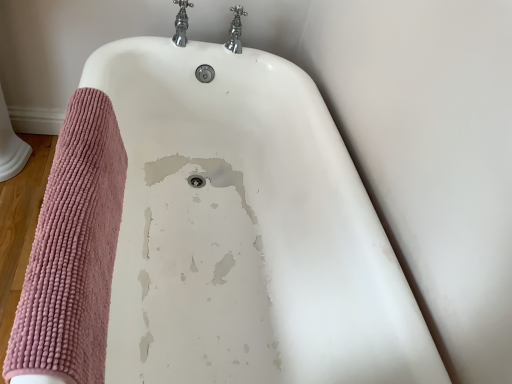
Measure the distance between point (180,10) and camera.

Point (180,10) is 1.57 meters away from camera.

Describe the element at coordinates (181, 23) in the screenshot. I see `chrome metallic faucet at upper center, which is the second tap in right-to-left order` at that location.

What do you see at coordinates (234, 30) in the screenshot?
I see `chrome metallic faucet at upper center, the second tap when ordered from left to right` at bounding box center [234, 30].

This screenshot has width=512, height=384. I want to click on chrome metallic faucet at upper center, positioned as the 1th tap in left-to-right order, so click(x=181, y=23).

Are chrome metallic faucet at upper center, the second tap when ordered from left to right, and pink chenille bath towel at left located far from each other?

No, there isn't a large distance between chrome metallic faucet at upper center, the second tap when ordered from left to right, and pink chenille bath towel at left.

How many degrees apart are the facing directions of chrome metallic faucet at upper center, the second tap when ordered from left to right, and pink chenille bath towel at left?

The facing directions of chrome metallic faucet at upper center, the second tap when ordered from left to right, and pink chenille bath towel at left are 88 degrees apart.

Relative to pink chenille bath towel at left, is chrome metallic faucet at upper center, the second tap when ordered from left to right, in front or behind?

Clearly, chrome metallic faucet at upper center, the second tap when ordered from left to right, is behind pink chenille bath towel at left.

Looking at this image, from a real-world perspective, between chrome metallic faucet at upper center, positioned as the 1th tap in left-to-right order, and chrome metallic faucet at upper center, the second tap when ordered from left to right, who is vertically higher?

chrome metallic faucet at upper center, the second tap when ordered from left to right.

Considering the sizes of objects chrome metallic faucet at upper center, which is the second tap in right-to-left order, and chrome metallic faucet at upper center, the second tap when ordered from left to right, in the image provided, who is shorter, chrome metallic faucet at upper center, which is the second tap in right-to-left order, or chrome metallic faucet at upper center, the second tap when ordered from left to right,?

chrome metallic faucet at upper center, which is the second tap in right-to-left order, is shorter.

From the image's perspective, which object appears higher, chrome metallic faucet at upper center, which is the second tap in right-to-left order, or chrome metallic faucet at upper center, acting as the first tap starting from the right?

From the image's view, chrome metallic faucet at upper center, which is the second tap in right-to-left order, is above.

From the image's perspective, which is above, chrome metallic faucet at upper center, positioned as the 1th tap in left-to-right order, or pink chenille bath towel at left?

From the image's view, chrome metallic faucet at upper center, positioned as the 1th tap in left-to-right order, is above.

From their relative heights in the image, would you say chrome metallic faucet at upper center, which is the second tap in right-to-left order, is taller or shorter than pink chenille bath towel at left?

In the image, chrome metallic faucet at upper center, which is the second tap in right-to-left order, appears to be shorter than pink chenille bath towel at left.

Considering the relative sizes of chrome metallic faucet at upper center, which is the second tap in right-to-left order, and pink chenille bath towel at left in the image provided, is chrome metallic faucet at upper center, which is the second tap in right-to-left order, thinner than pink chenille bath towel at left?

In fact, chrome metallic faucet at upper center, which is the second tap in right-to-left order, might be wider than pink chenille bath towel at left.

Is chrome metallic faucet at upper center, acting as the first tap starting from the right, not near white glossy bathtub at center?

No.

Image resolution: width=512 pixels, height=384 pixels. What are the coordinates of `bathtub on the left of chrome metallic faucet at upper center, the second tap when ordered from left to right` in the screenshot? It's located at (246, 230).

Considering the relative sizes of chrome metallic faucet at upper center, acting as the first tap starting from the right, and white glossy bathtub at center in the image provided, is chrome metallic faucet at upper center, acting as the first tap starting from the right, bigger than white glossy bathtub at center?

Actually, chrome metallic faucet at upper center, acting as the first tap starting from the right, might be smaller than white glossy bathtub at center.

Looking at this image, between chrome metallic faucet at upper center, acting as the first tap starting from the right, and white glossy bathtub at center, which one has smaller width?

chrome metallic faucet at upper center, acting as the first tap starting from the right, is thinner.

Does pink chenille bath towel at left come behind white glossy bathtub at center?

Yes, pink chenille bath towel at left is further from the camera.

From a real-world perspective, who is located lower, pink chenille bath towel at left or white glossy bathtub at center?

From a 3D spatial view, white glossy bathtub at center is below.

Is pink chenille bath towel at left outside of white glossy bathtub at center?

Actually, pink chenille bath towel at left is within white glossy bathtub at center.

From the image's perspective, who appears lower, pink chenille bath towel at left or white glossy bathtub at center?

white glossy bathtub at center appears lower in the image.

Identify the location of the 2nd tap behind the pink chenille bath towel at left. (234, 30).

Which object is closer to the camera taking this photo, pink chenille bath towel at left or chrome metallic faucet at upper center, acting as the first tap starting from the right?

pink chenille bath towel at left is closer to the camera.

Considering the relative positions of pink chenille bath towel at left and chrome metallic faucet at upper center, the second tap when ordered from left to right, in the image provided, is pink chenille bath towel at left to the left or to the right of chrome metallic faucet at upper center, the second tap when ordered from left to right,?

In the image, pink chenille bath towel at left appears on the left side of chrome metallic faucet at upper center, the second tap when ordered from left to right.

From the image's perspective, which one is positioned higher, pink chenille bath towel at left or chrome metallic faucet at upper center, acting as the first tap starting from the right?

From the image's view, chrome metallic faucet at upper center, acting as the first tap starting from the right, is above.

From a real-world perspective, which is physically above, white glossy bathtub at center or chrome metallic faucet at upper center, positioned as the 1th tap in left-to-right order?

chrome metallic faucet at upper center, positioned as the 1th tap in left-to-right order, is physically above.

Measure the distance from white glossy bathtub at center to chrome metallic faucet at upper center, positioned as the 1th tap in left-to-right order.

They are 26.54 inches apart.

Is white glossy bathtub at center with chrome metallic faucet at upper center, positioned as the 1th tap in left-to-right order?

No, white glossy bathtub at center is not making contact with chrome metallic faucet at upper center, positioned as the 1th tap in left-to-right order.

Is white glossy bathtub at center closer to the viewer compared to chrome metallic faucet at upper center, which is the second tap in right-to-left order?

Yes, white glossy bathtub at center is closer to the camera.

Where is `the 2nd tap behind when counting from the pink chenille bath towel at left`? The width and height of the screenshot is (512, 384). the 2nd tap behind when counting from the pink chenille bath towel at left is located at coordinates (234, 30).

The width and height of the screenshot is (512, 384). In order to click on tap above the chrome metallic faucet at upper center, which is the second tap in right-to-left order (from a real-world perspective) in this screenshot , I will do `click(234, 30)`.

From the image, which object appears to be nearer to white glossy bathtub at center, pink chenille bath towel at left or chrome metallic faucet at upper center, which is the second tap in right-to-left order?

Among the two, pink chenille bath towel at left is located nearer to white glossy bathtub at center.

Based on their spatial positions, is chrome metallic faucet at upper center, acting as the first tap starting from the right, or pink chenille bath towel at left further from chrome metallic faucet at upper center, which is the second tap in right-to-left order?

pink chenille bath towel at left is positioned further to the anchor chrome metallic faucet at upper center, which is the second tap in right-to-left order.

From the picture: Which object lies further to the anchor point white glossy bathtub at center, chrome metallic faucet at upper center, which is the second tap in right-to-left order, or pink chenille bath towel at left?

Among the two, chrome metallic faucet at upper center, which is the second tap in right-to-left order, is located further to white glossy bathtub at center.

Estimate the real-world distances between objects in this image. Which object is closer to chrome metallic faucet at upper center, the second tap when ordered from left to right, chrome metallic faucet at upper center, positioned as the 1th tap in left-to-right order, or white glossy bathtub at center?

chrome metallic faucet at upper center, positioned as the 1th tap in left-to-right order, is positioned closer to the anchor chrome metallic faucet at upper center, the second tap when ordered from left to right.

When comparing their distances from chrome metallic faucet at upper center, acting as the first tap starting from the right, does white glossy bathtub at center or pink chenille bath towel at left seem closer?

white glossy bathtub at center.

From the image, which object appears to be farther from pink chenille bath towel at left, chrome metallic faucet at upper center, positioned as the 1th tap in left-to-right order, or white glossy bathtub at center?

chrome metallic faucet at upper center, positioned as the 1th tap in left-to-right order.

Based on their spatial positions, is chrome metallic faucet at upper center, acting as the first tap starting from the right, or white glossy bathtub at center further from pink chenille bath towel at left?

chrome metallic faucet at upper center, acting as the first tap starting from the right, is positioned further to the anchor pink chenille bath towel at left.

From the image, which object appears to be farther from pink chenille bath towel at left, chrome metallic faucet at upper center, positioned as the 1th tap in left-to-right order, or chrome metallic faucet at upper center, the second tap when ordered from left to right?

chrome metallic faucet at upper center, positioned as the 1th tap in left-to-right order.

Locate an element on the screen. The width and height of the screenshot is (512, 384). tap between white glossy bathtub at center and chrome metallic faucet at upper center, acting as the first tap starting from the right, in the front-back direction is located at coordinates (181, 23).

Locate an element on the screen. bath towel positioned between white glossy bathtub at center and chrome metallic faucet at upper center, positioned as the 1th tap in left-to-right order, from near to far is located at coordinates (73, 250).

Where is `tap located between pink chenille bath towel at left and chrome metallic faucet at upper center, acting as the first tap starting from the right, in the depth direction`? tap located between pink chenille bath towel at left and chrome metallic faucet at upper center, acting as the first tap starting from the right, in the depth direction is located at coordinates (181, 23).

The image size is (512, 384). Find the location of `bath towel located between white glossy bathtub at center and chrome metallic faucet at upper center, the second tap when ordered from left to right, in the depth direction`. bath towel located between white glossy bathtub at center and chrome metallic faucet at upper center, the second tap when ordered from left to right, in the depth direction is located at coordinates (73, 250).